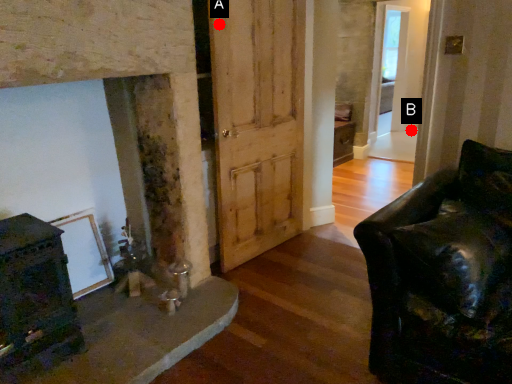
Question: Two points are circled on the image, labeled by A and B beside each circle. Which point is farther to the camera?

Choices:
 (A) A is further
 (B) B is further

Answer: (B)